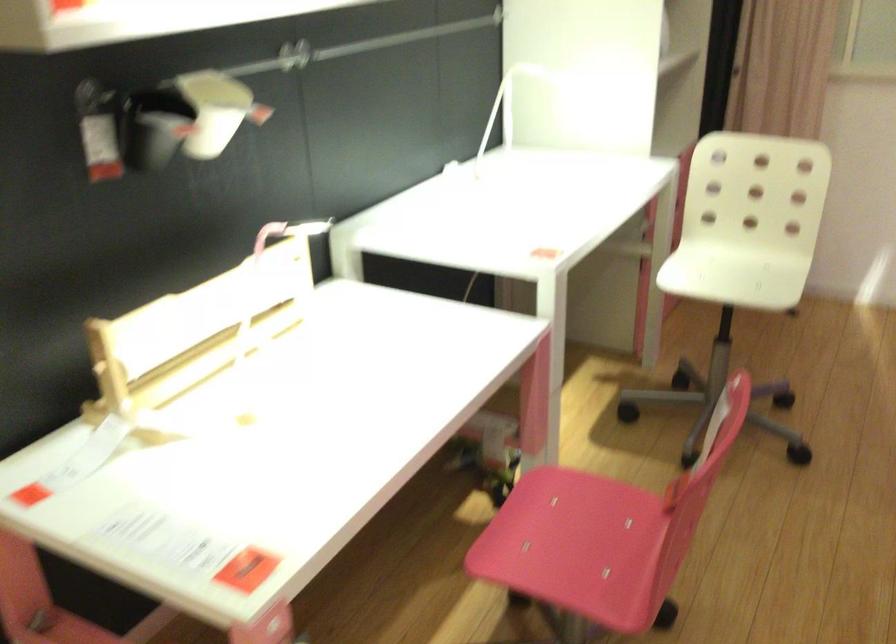
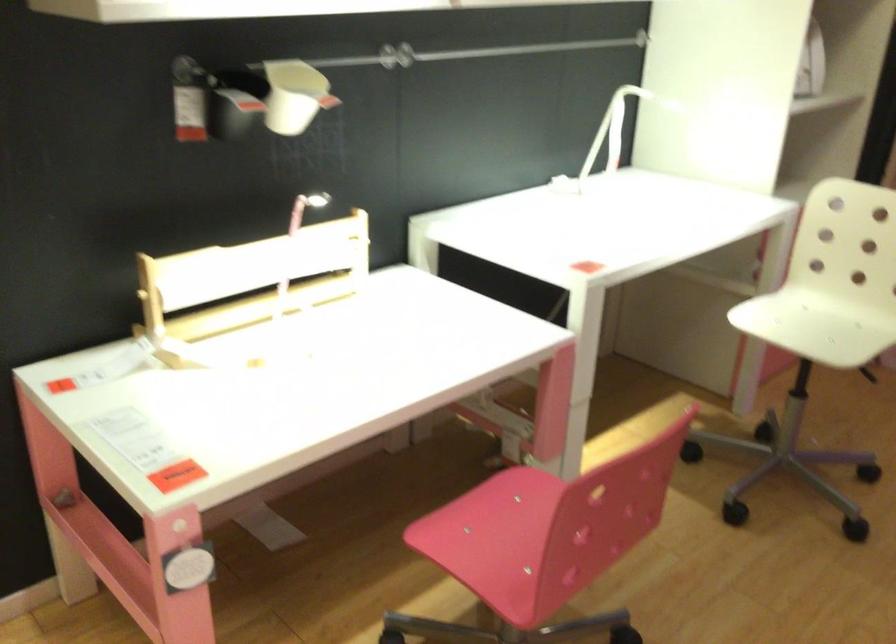
Locate, in the second image, the point that corresponds to pixel 161 142 in the first image.

(227, 114)